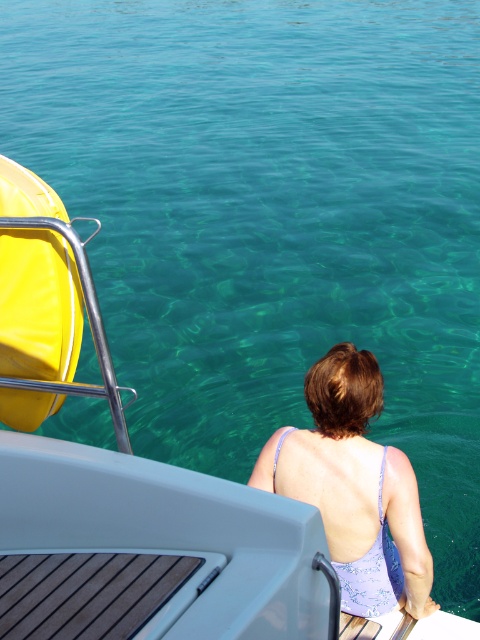
You are a photographer trying to capture the woman in the purple fabric swimsuit at center and the matte yellow life jacket at left. Since you want to ensure both are visible in the frame, which object should you position closer to the camera to avoid cropping?

The purple fabric swimsuit at center is wider than the matte yellow life jacket at left, so positioning the purple fabric swimsuit at center closer to the camera will ensure it remains visible without cropping, as its greater width requires more space in the frame.

From the picture: You are standing on the boat and looking at two points marked on the deck. The first point is at coordinate point [393,605] and the second is at point [15,358]. If you want to move from the closer point to the farther one, which direction should you move?

Point [393,605] is further to the viewer than point [15,358]. To move from the closer point to the farther one, you should move towards the direction of point [393,605].